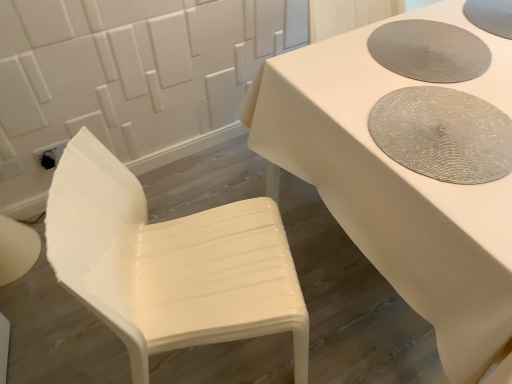
This screenshot has width=512, height=384. I want to click on vacant space in textured gray mat at upper right, which appears as the 1th manhole cover when ordered from the bottom (from a real-world perspective), so click(x=444, y=127).